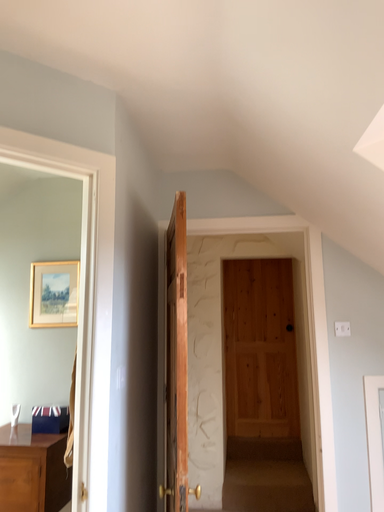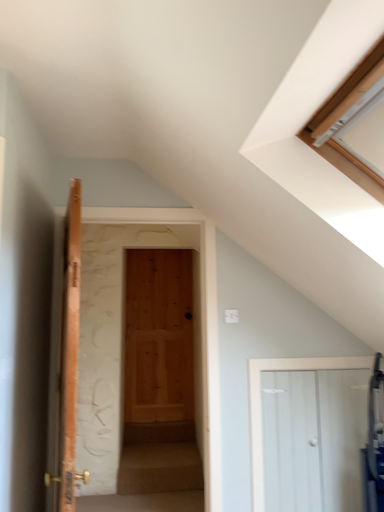
Question: How did the camera likely rotate when shooting the video?

Choices:
 (A) rotated right
 (B) rotated left

Answer: (A)